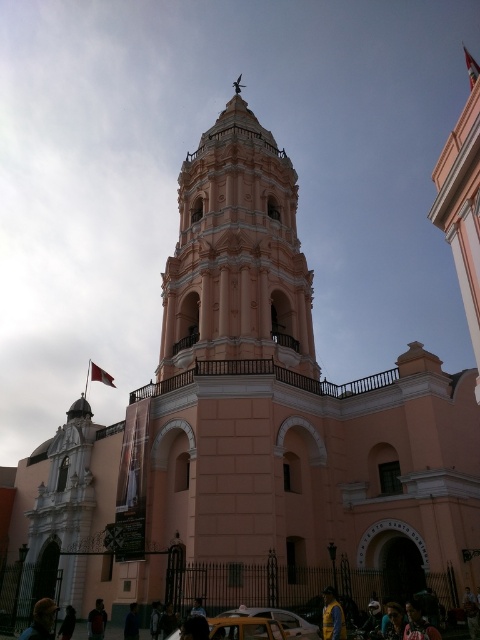
Can you confirm if yellow matte taxi at lower center is shorter than dark blue shirt at center?

Correct, yellow matte taxi at lower center is not as tall as dark blue shirt at center.

Between yellow matte taxi at lower center and dark blue shirt at center, which one appears on the right side from the viewer's perspective?

yellow matte taxi at lower center is more to the right.

This screenshot has width=480, height=640. I want to click on yellow matte taxi at lower center, so click(x=279, y=620).

Locate an element on the screen. This screenshot has height=640, width=480. yellow matte taxi at lower center is located at coordinates (279, 620).

Can you confirm if yellow fabric at lower center is positioned below dark blue shirt at center?

Yes.

Which is below, yellow fabric at lower center or dark blue shirt at center?

yellow fabric at lower center

Is point (325, 618) positioned before point (193, 625)?

No, (325, 618) is behind (193, 625).

Identify the location of yellow fabric at lower center. The width and height of the screenshot is (480, 640). (332, 616).

How much distance is there between golden hair at lower left and yellow fabric at lower center?

golden hair at lower left and yellow fabric at lower center are 24.15 meters apart.

Find the location of `golden hair at lower left`. golden hair at lower left is located at coordinates (40, 620).

Find the location of a particular element. This screenshot has height=640, width=480. golden hair at lower left is located at coordinates (40, 620).